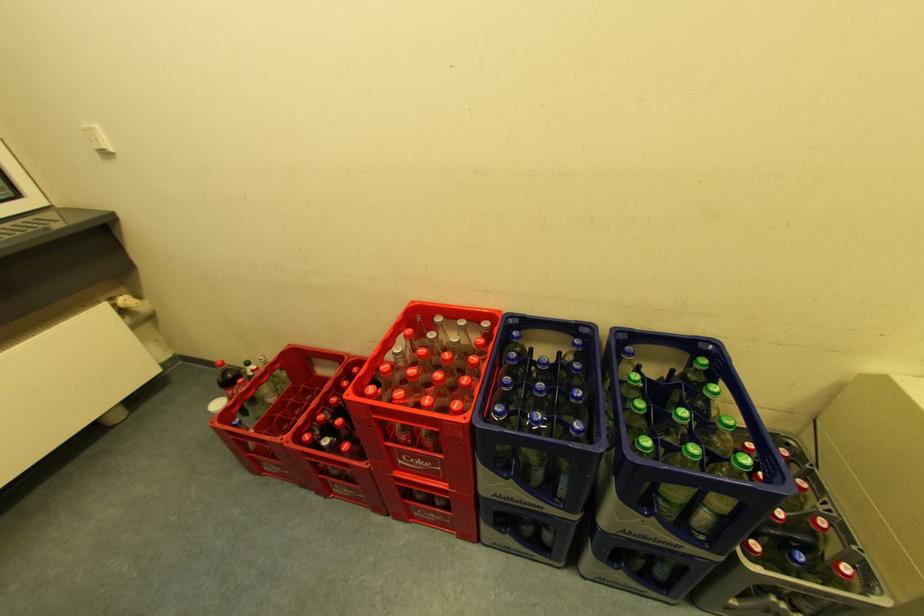
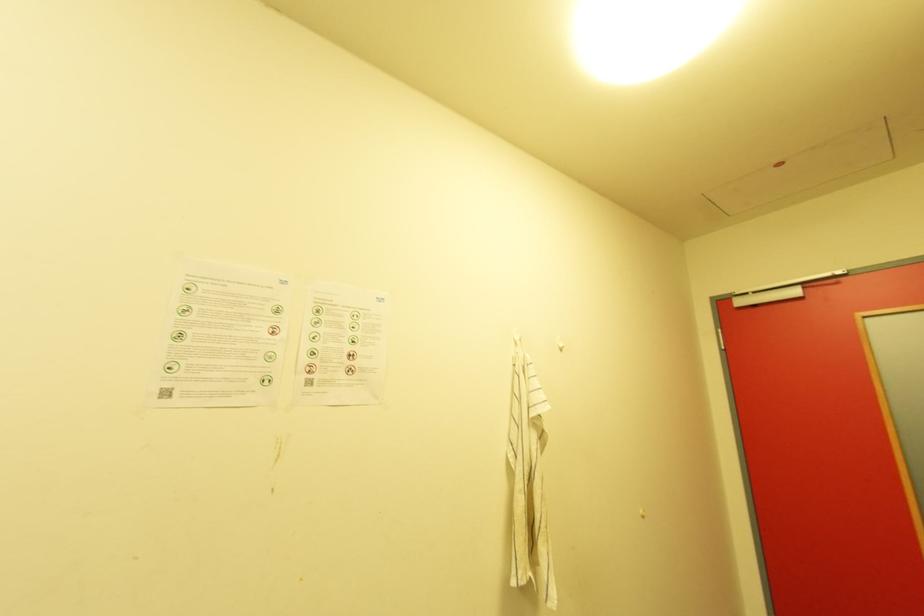
How did the camera likely rotate?

The camera's rotation is toward right-up.